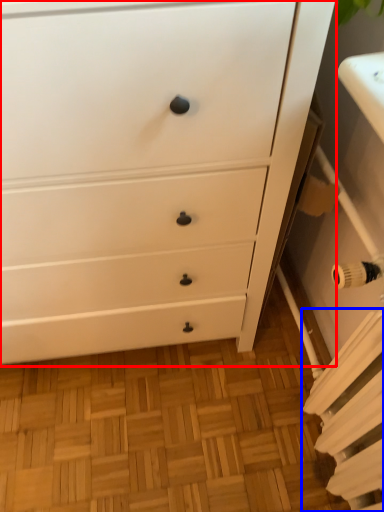
Question: Which object appears farthest to the camera in this image, chest of drawers (highlighted by a red box) or radiator (highlighted by a blue box)?

Choices:
 (A) chest of drawers
 (B) radiator

Answer: (B)